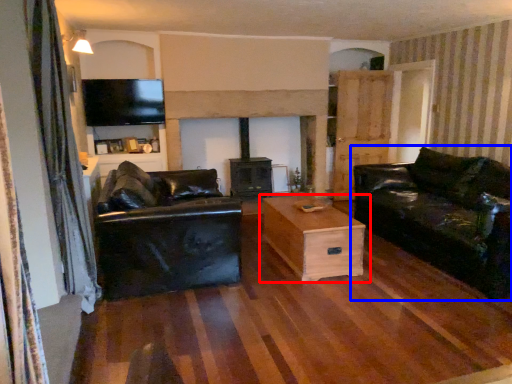
Question: Which point is closer to the camera, table (highlighted by a red box) or studio couch (highlighted by a blue box)?

Choices:
 (A) table
 (B) studio couch

Answer: (B)